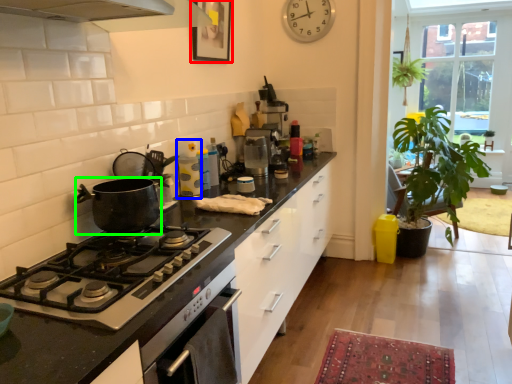
Question: Which object is the farthest from picture frame (highlighted by a red box)? Choose among these: appliance (highlighted by a blue box) or kitchen appliance (highlighted by a green box).

Choices:
 (A) appliance
 (B) kitchen appliance

Answer: (B)